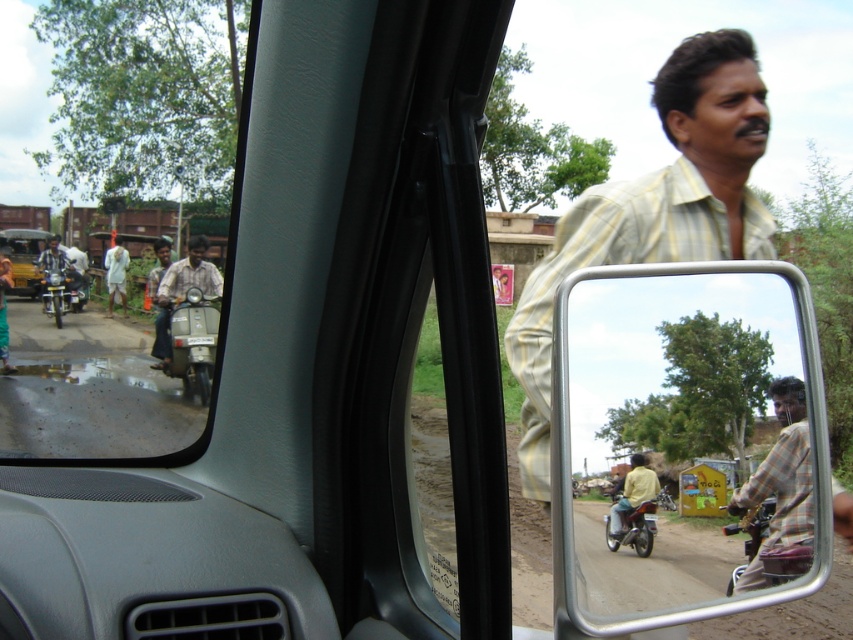
How distant is clear glass window at upper left from metallic silver scooter at left?

The distance of clear glass window at upper left from metallic silver scooter at left is 7.96 feet.

Between clear glass window at upper left and metallic silver scooter at left, which one is positioned lower?

metallic silver scooter at left is below.

Locate an element on the screen. Image resolution: width=853 pixels, height=640 pixels. clear glass window at upper left is located at coordinates (119, 371).

Does point (164, 316) lie in front of point (120, 276)?

Yes, point (164, 316) is closer to viewer.

Between light brown shirt at left and white cotton shirt at left, which one appears on the right side from the viewer's perspective?

Positioned to the right is light brown shirt at left.

Measure the distance between light brown shirt at left and camera.

light brown shirt at left and camera are 9.17 meters apart.

Identify the location of light brown shirt at left. (160, 305).

Is the position of matte black auto-rickshaw at left less distant than that of metallic silver motorcycle at right?

No, matte black auto-rickshaw at left is behind metallic silver motorcycle at right.

Is matte black auto-rickshaw at left shorter than metallic silver motorcycle at right?

No, matte black auto-rickshaw at left is not shorter than metallic silver motorcycle at right.

This screenshot has height=640, width=853. Identify the location of matte black auto-rickshaw at left. (24, 259).